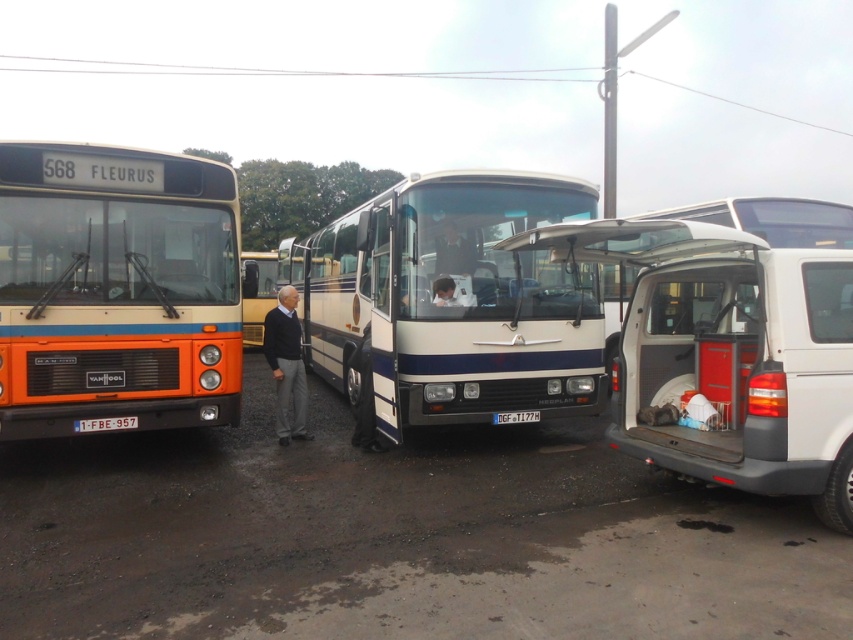
You are a parking attendant who needs to check license plates. You see the white plastic license plate at center and the black plastic license plate at center. Which license plate is above the other?

The white plastic license plate at center is positioned over the black plastic license plate at center, so the white one is above the black one.

You are a security guard at the bus depot and need to verify the license plate of the white bus. However, there is a person standing in front of it. Which object is closer to you between the white plastic license plate at center and the smooth skin face at center?

The smooth skin face at center is closer to you than the white plastic license plate at center, so you cannot see the license plate clearly because the face is blocking it.